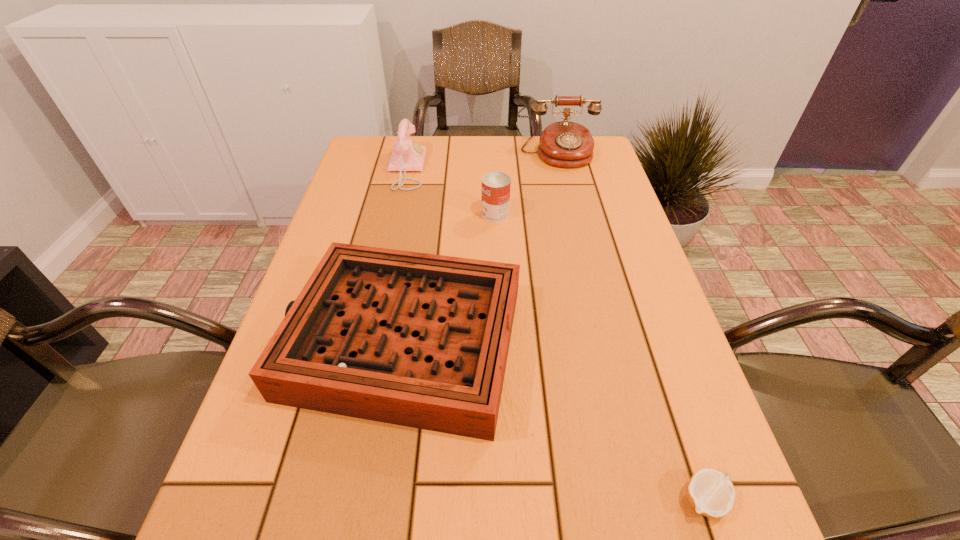
This screenshot has width=960, height=540. What are the coordinates of `blank space located on the front label of the can` in the screenshot? It's located at (433, 215).

Identify the location of vacant space located 0.170m on the front label of the can. Image resolution: width=960 pixels, height=540 pixels. (418, 215).

This screenshot has width=960, height=540. I want to click on free location located on the front label of the can, so click(331, 215).

Image resolution: width=960 pixels, height=540 pixels. I want to click on vacant area situated on the right of the second shortest object, so click(x=601, y=338).

Find the location of a particular element. vacant space located 0.140m on the back of the nearest object is located at coordinates (670, 397).

Find the location of `telephone at the left edge`. telephone at the left edge is located at coordinates (407, 155).

Locate an element on the screen. The width and height of the screenshot is (960, 540). gameboard at the left edge is located at coordinates (414, 339).

Identify the location of telephone at the right edge. (566, 144).

At what (x,y) coordinates should I click in order to perform the action: click on lemon that is at the right edge. Please return your answer as a coordinate pair (x, y). Image resolution: width=960 pixels, height=540 pixels. Looking at the image, I should click on (711, 493).

Locate an element on the screen. Image resolution: width=960 pixels, height=540 pixels. object that is at the far left corner is located at coordinates (407, 155).